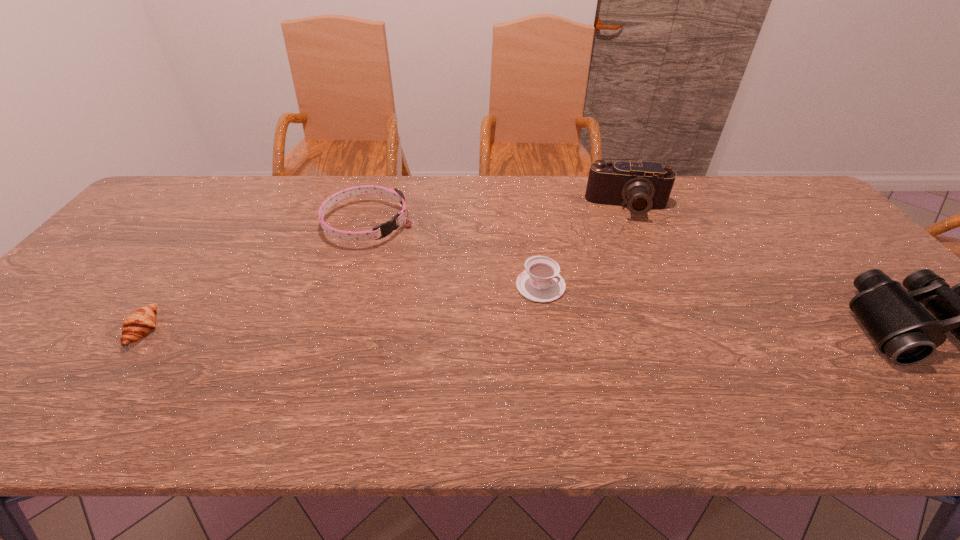
This screenshot has width=960, height=540. Find the location of `free space on the desktop that is between the shortest object and the rightmost object and is positioned on the front-facing side of the camera`. free space on the desktop that is between the shortest object and the rightmost object and is positioned on the front-facing side of the camera is located at coordinates (640, 327).

At what (x,y) coordinates should I click in order to perform the action: click on free space on the desktop that is between the shortest object and the binoculars and is positioned with the buckle on the dog collar. Please return your answer as a coordinate pair (x, y). Image resolution: width=960 pixels, height=540 pixels. Looking at the image, I should click on (545, 327).

Locate an element on the screen. The image size is (960, 540). vacant space on the desktop that is between the shortest object and the binoculars and is positioned on the handle side of the third object from left to right is located at coordinates (621, 327).